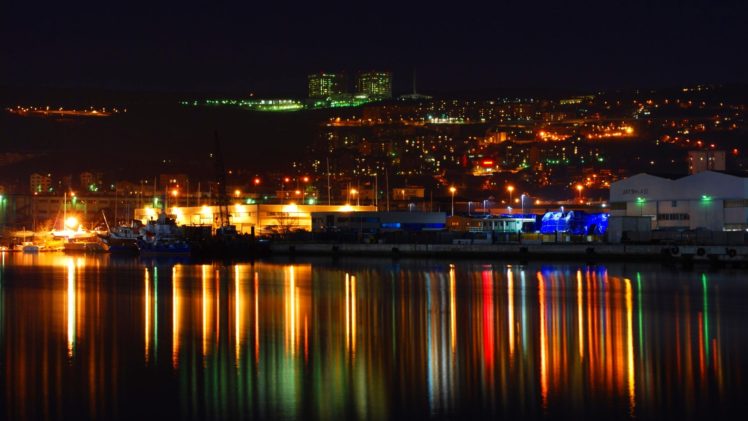
This screenshot has height=421, width=748. Identify the location of garage doorway. (672, 207).